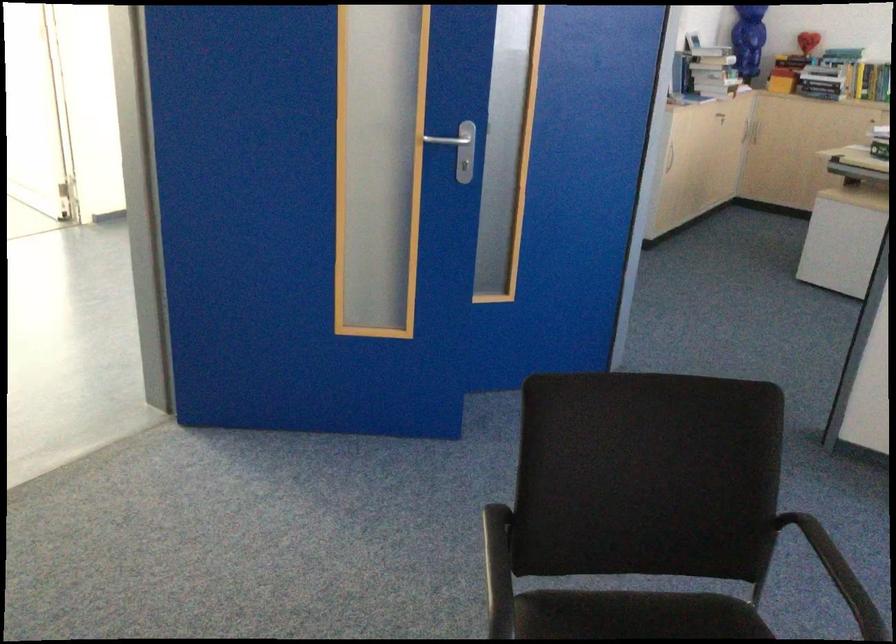
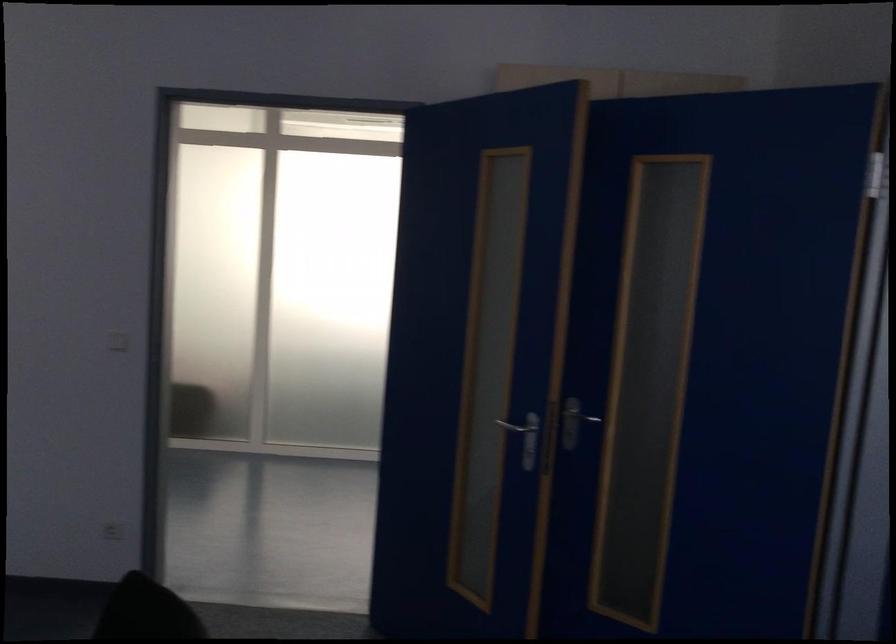
Where in the second image is the point corresponding to (328,147) from the first image?

(573, 422)